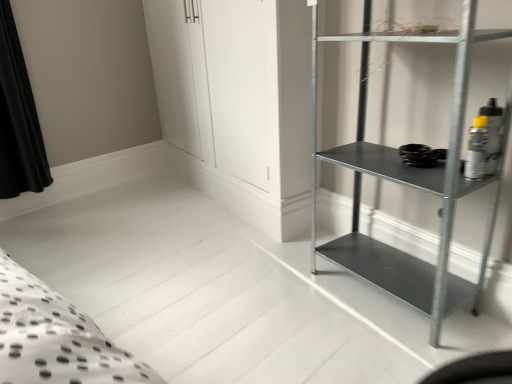
Locate an element on the screen. This screenshot has width=512, height=384. free space above metallic gray shelf at right (from a real-world perspective) is located at coordinates (410, 211).